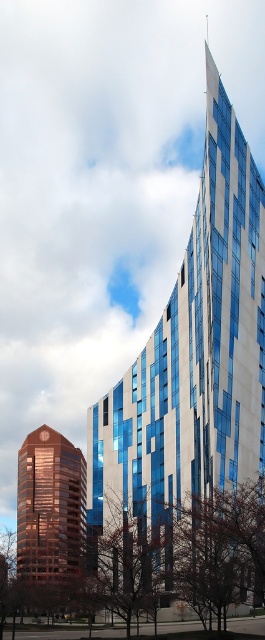
Question: Which object is farther from the camera taking this photo?

Choices:
 (A) blue glass building at center
 (B) shiny brown tower at lower left

Answer: (B)

Question: Is the position of blue glass building at center less distant than that of shiny brown tower at lower left?

Choices:
 (A) yes
 (B) no

Answer: (A)

Question: Which of the following is the farthest from the observer?

Choices:
 (A) (27, 509)
 (B) (89, 476)

Answer: (A)

Question: Is blue glass building at center to the right of shiny brown tower at lower left from the viewer's perspective?

Choices:
 (A) no
 (B) yes

Answer: (B)

Question: Is blue glass building at center above shiny brown tower at lower left?

Choices:
 (A) no
 (B) yes

Answer: (B)

Question: Which point is closer to the camera taking this photo?

Choices:
 (A) (62, 497)
 (B) (257, 321)

Answer: (B)